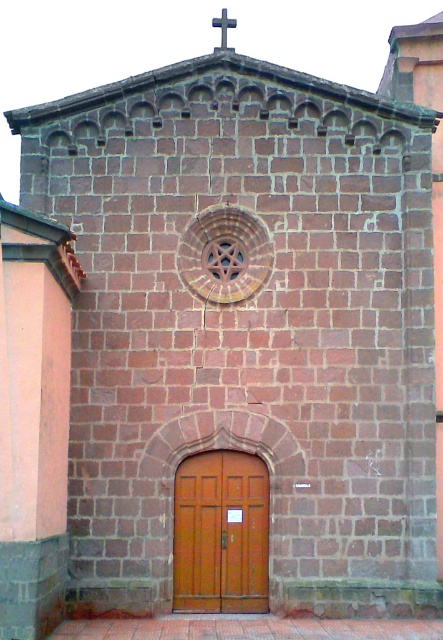
You are standing in front of the church and want to enter. The wooden door at center is partially blocked by a fallen tree branch. To reach the door, you need to go around the obstacle. Which direction should you move relative to the white plastic cross at upper center?

The wooden door at center is positioned on the right side of the white plastic cross at upper center. Therefore, to reach the door, you should move to the right of the white plastic cross at upper center to go around the obstacle.